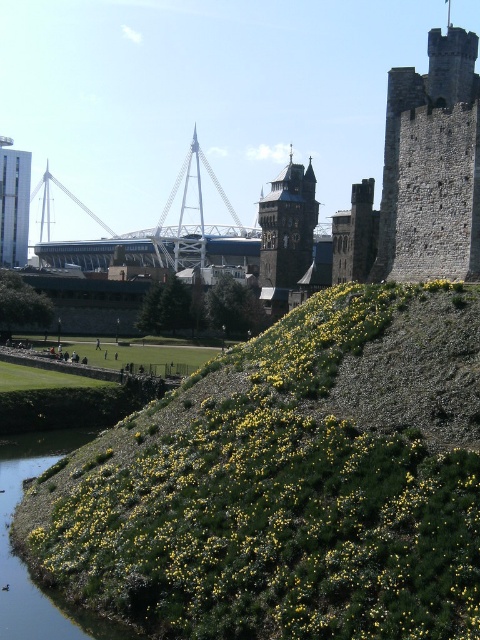
You are standing at the top of the hill in the image. You see the green grassy river at lower left and the smooth white tower at left. Which object is closer to the ground?

The green grassy river at lower left is shorter than the smooth white tower at left, so the green grassy river at lower left is closer to the ground.

You are a gardener planning to plant new shrubs in the area. You have a limited space of 2 meters in width. The green leafy shrub at lower center and the smooth white tower at left are in the way. Which object can be moved to accommodate the new shrubs without affecting the historical structure?

The green leafy shrub at lower center can be moved since it has a smaller size compared to the smooth white tower at left, making it easier to relocate without affecting the historical structure.